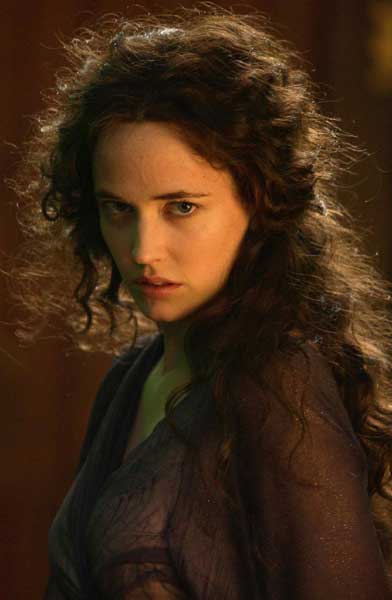
Locate an element on the screen. the chest is located at coordinates (136, 437).